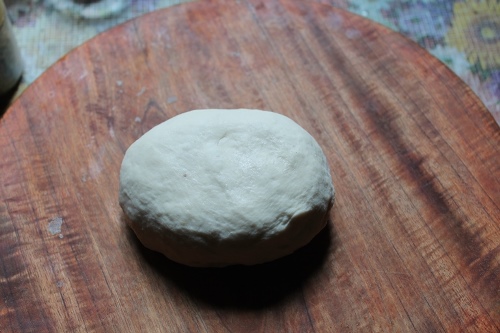
Locate an element on the screen. The width and height of the screenshot is (500, 333). natural pattern in wood is located at coordinates (359, 88), (386, 128), (421, 173).